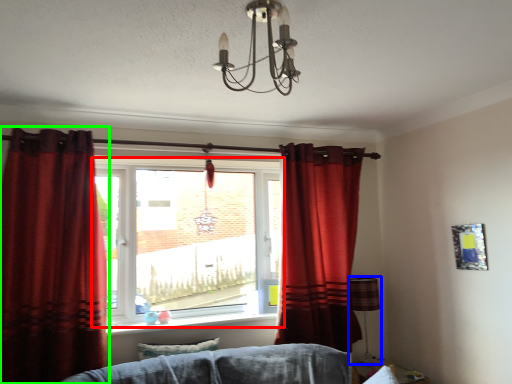
Question: Which object is positioned farthest from window (highlighted by a red box)? Select from lamp (highlighted by a blue box) and curtain (highlighted by a green box).

Choices:
 (A) lamp
 (B) curtain

Answer: (A)